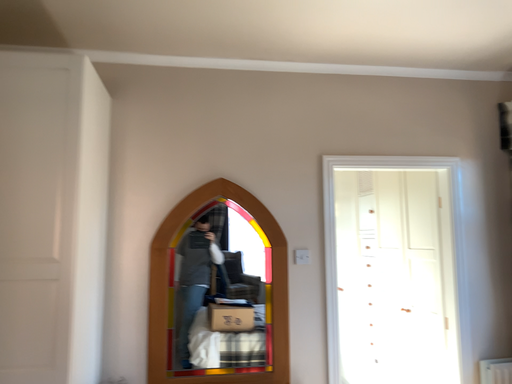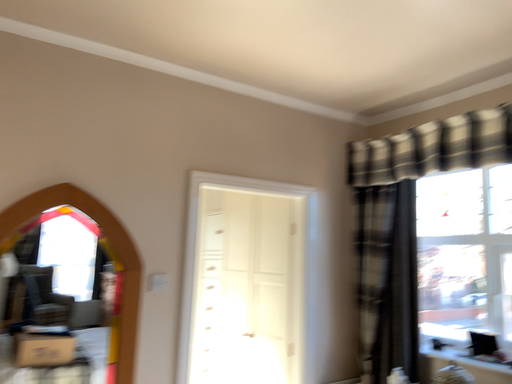
Question: How did the camera likely rotate when shooting the video?

Choices:
 (A) rotated left
 (B) rotated right

Answer: (B)